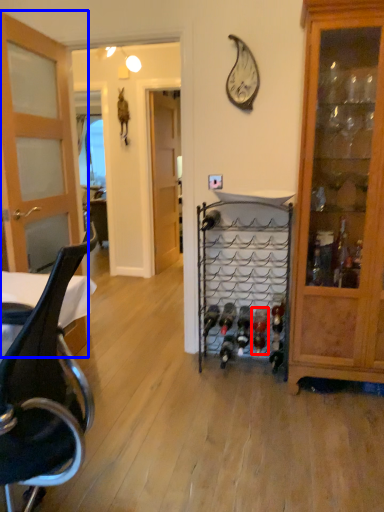
Question: Which point is closer to the camera, wine bottle (highlighted by a red box) or door (highlighted by a blue box)?

Choices:
 (A) wine bottle
 (B) door

Answer: (B)